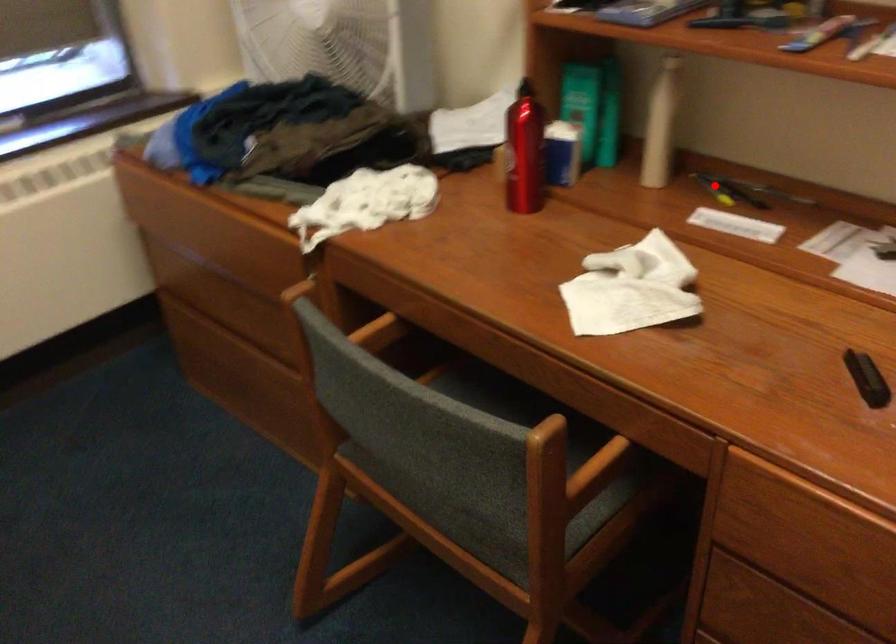
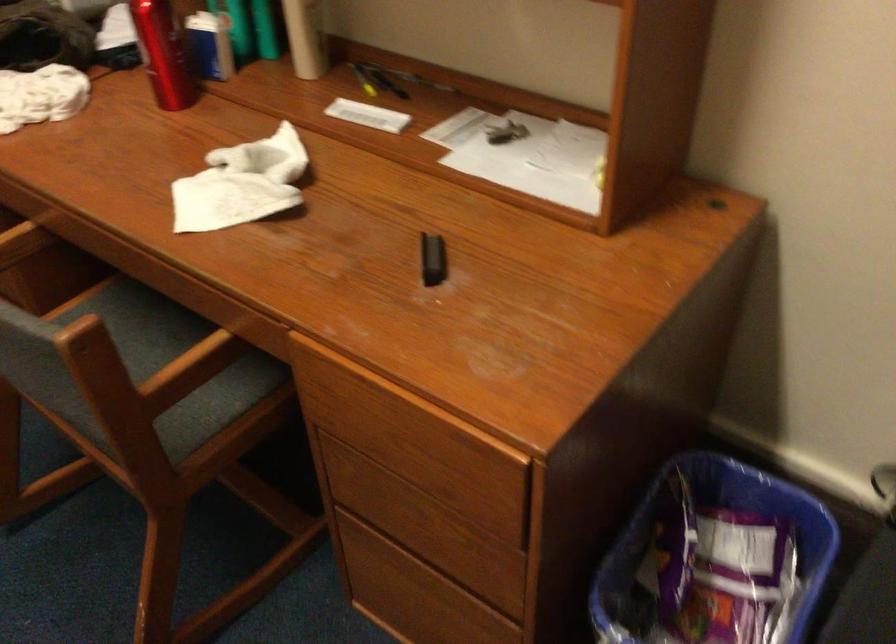
In the second image, find the point that corresponds to the highlighted location in the first image.

(363, 80)